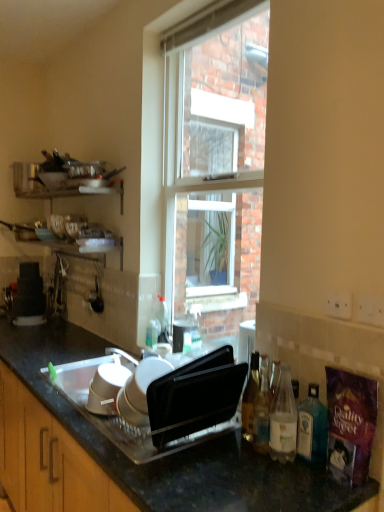
At what (x,y) coordinates should I click in order to perform the action: click on free space to the left of translucent glass bottle at lower right, acting as the second bottle starting from the left. Please return your answer as a coordinate pair (x, y). This screenshot has width=384, height=512. Looking at the image, I should click on (216, 450).